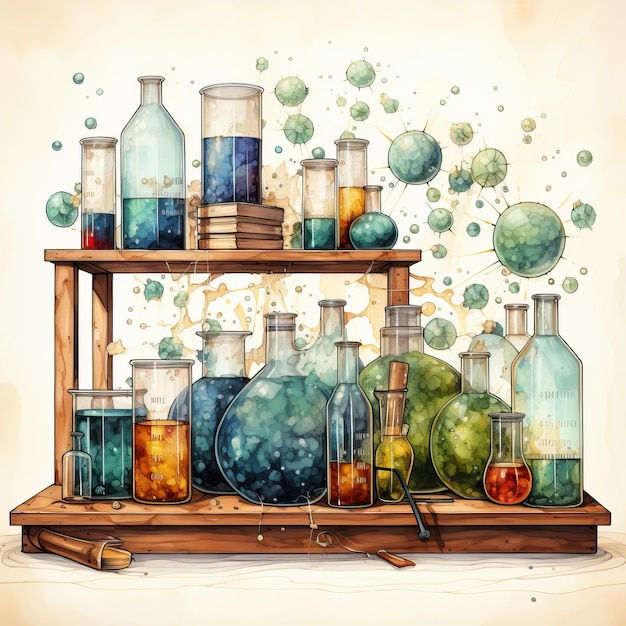
This screenshot has height=626, width=626. In order to click on beige wall in this screenshot , I will do `click(422, 57)`.